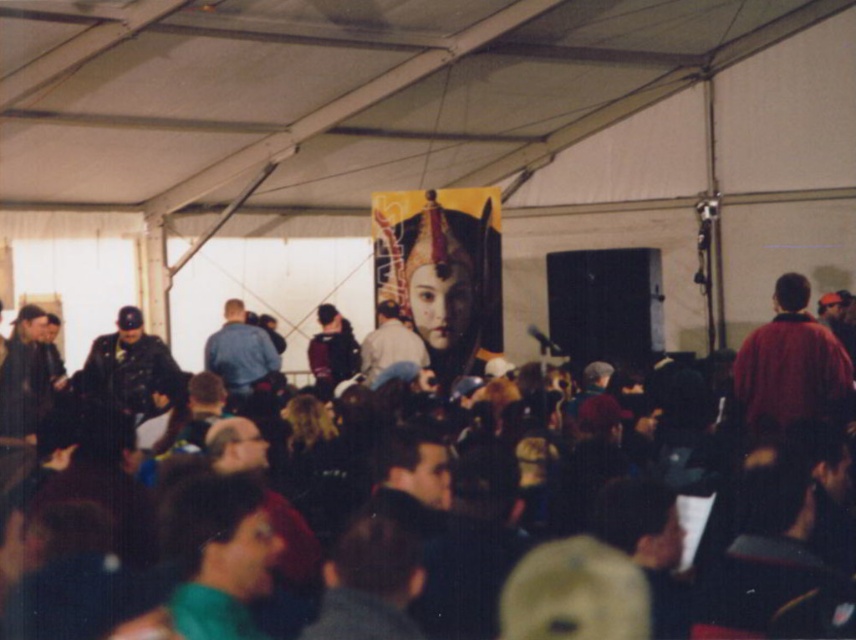
Describe the element at coordinates (789, 368) in the screenshot. I see `red matte jacket at right` at that location.

Is point (791, 356) positioned before point (278, 356)?

Yes, point (791, 356) is in front of point (278, 356).

At what (x,y) coordinates should I click in order to perform the action: click on red matte jacket at right. Please return your answer as a coordinate pair (x, y). The height and width of the screenshot is (640, 856). Looking at the image, I should click on (789, 368).

Between point (220, 572) and point (795, 362), which one is positioned behind?

The point (795, 362) is behind.

Does dark brown hair at center have a lesser width compared to red matte jacket at right?

No.

Which is behind, point (777, 545) or point (788, 339)?

The point (788, 339) is more distant.

This screenshot has height=640, width=856. What are the coordinates of `dark brown hair at center` in the screenshot? It's located at (153, 576).

Between dark brown hair at center and blue denim jacket at center, which one is positioned higher?

blue denim jacket at center is above.

Does point (389, 593) come in front of point (221, 358)?

Yes, point (389, 593) is closer to viewer.

Image resolution: width=856 pixels, height=640 pixels. I want to click on dark brown hair at center, so click(153, 576).